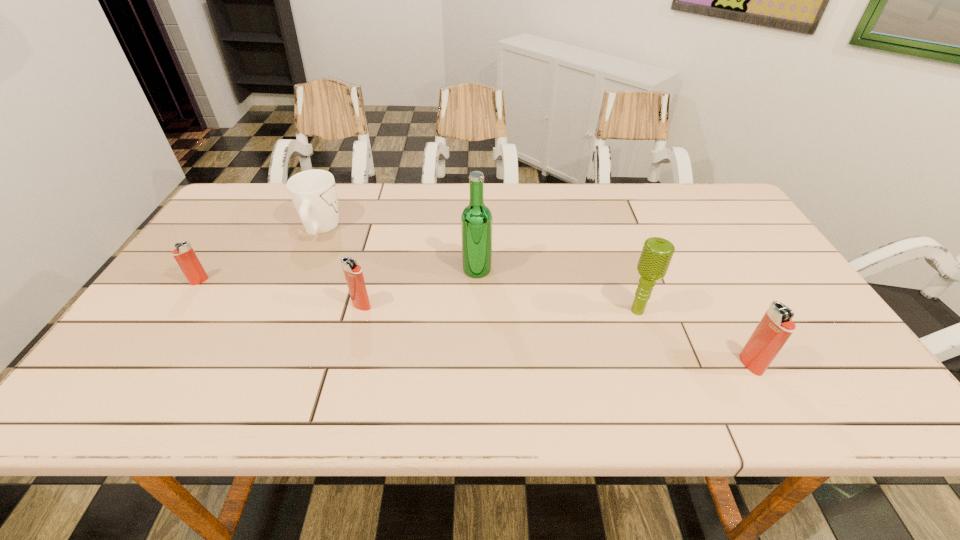
To achieve even spacing by inserting another igniter among them, please point to a vacant spot for this new igniter. Please provide its 2D coordinates. Your answer should be formatted as a tuple, i.e. [(x, y)], where the tuple contains the x and y coordinates of a point satisfying the conditions above.

[(544, 333)]